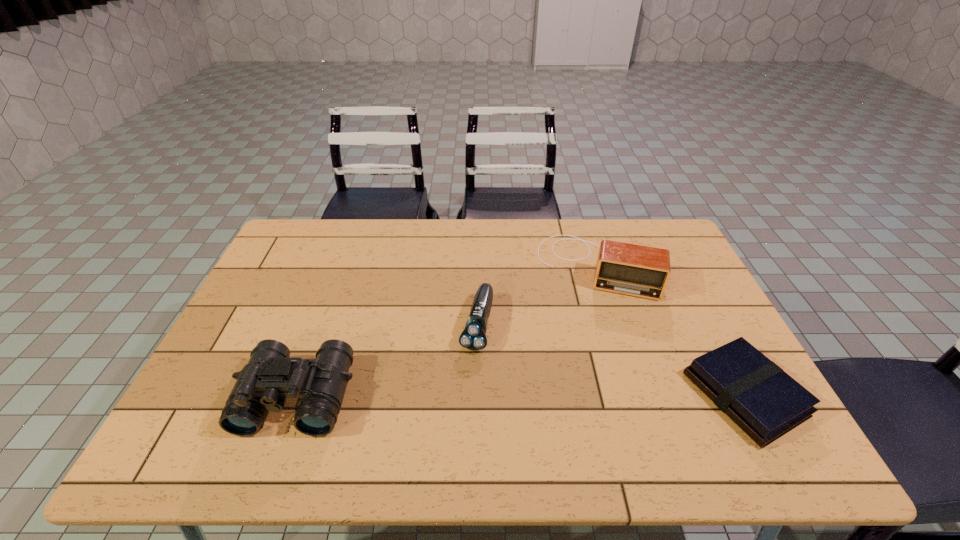
The width and height of the screenshot is (960, 540). I want to click on free region that satisfies the following two spatial constraints: 1. on the front side of the second object from left to right; 2. on the right side of the book, so click(x=476, y=395).